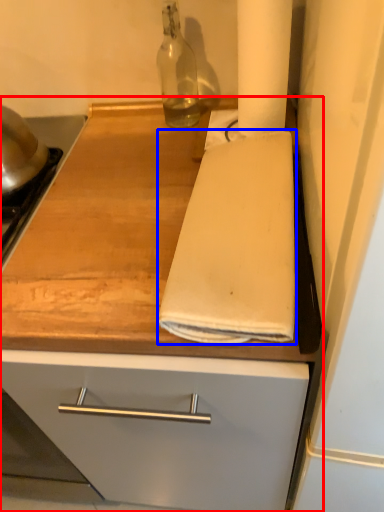
Question: Which point is further to the camera, countertop (highlighted by a red box) or bath towel (highlighted by a blue box)?

Choices:
 (A) countertop
 (B) bath towel

Answer: (B)